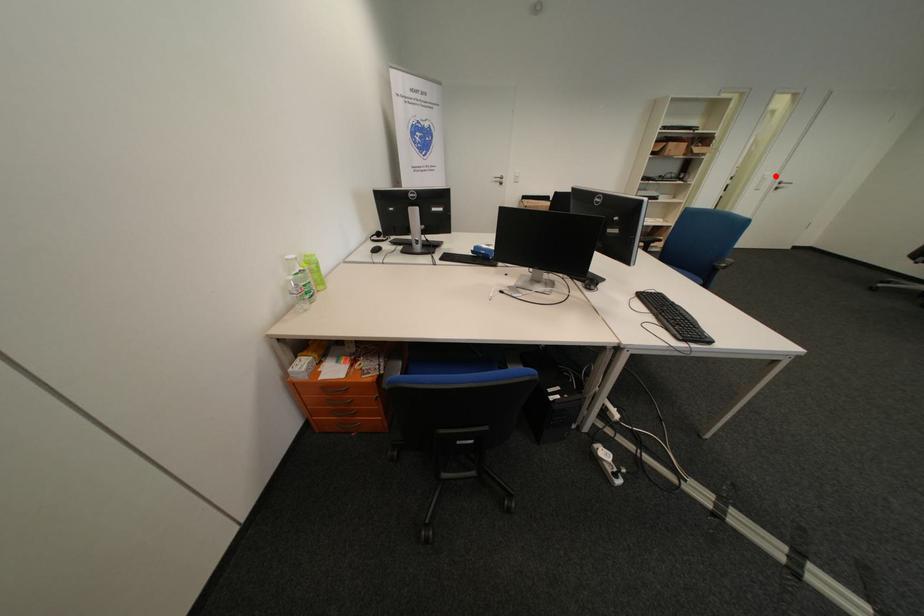
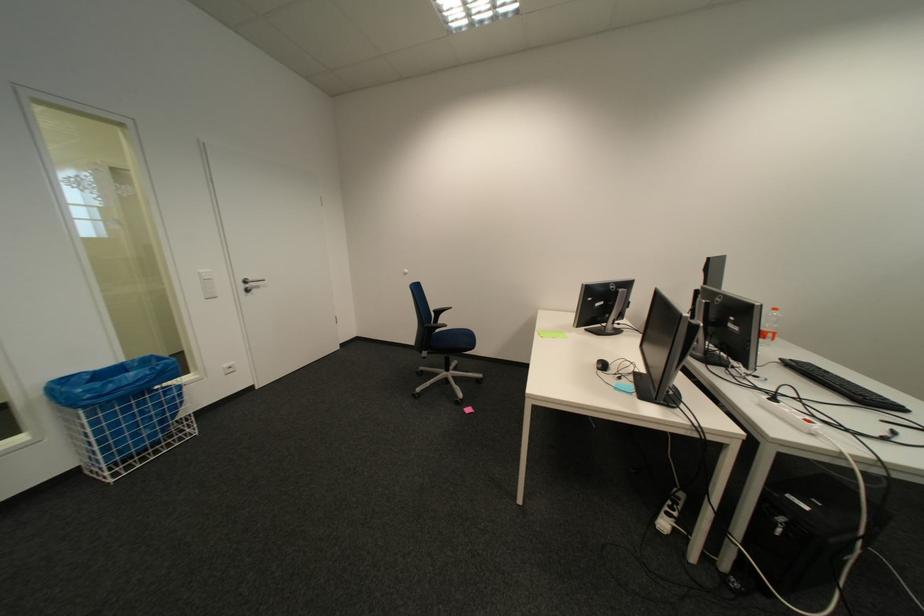
Locate, in the second image, the point that corresponds to the highlighted location in the first image.

(212, 275)